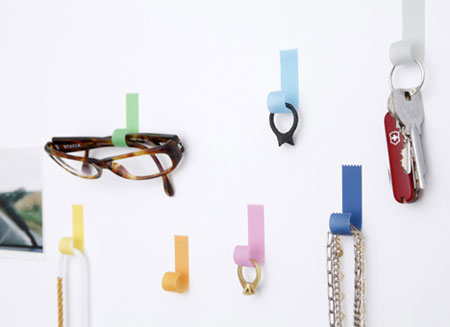
You are a GUI agent. You are given a task and a screenshot of the screen. Output one action in this format:
    pyautogui.click(x=<x>, y=<y>)
    Task: Click on the pink hook
    
    Given the screenshot: What is the action you would take?
    pyautogui.click(x=258, y=233)